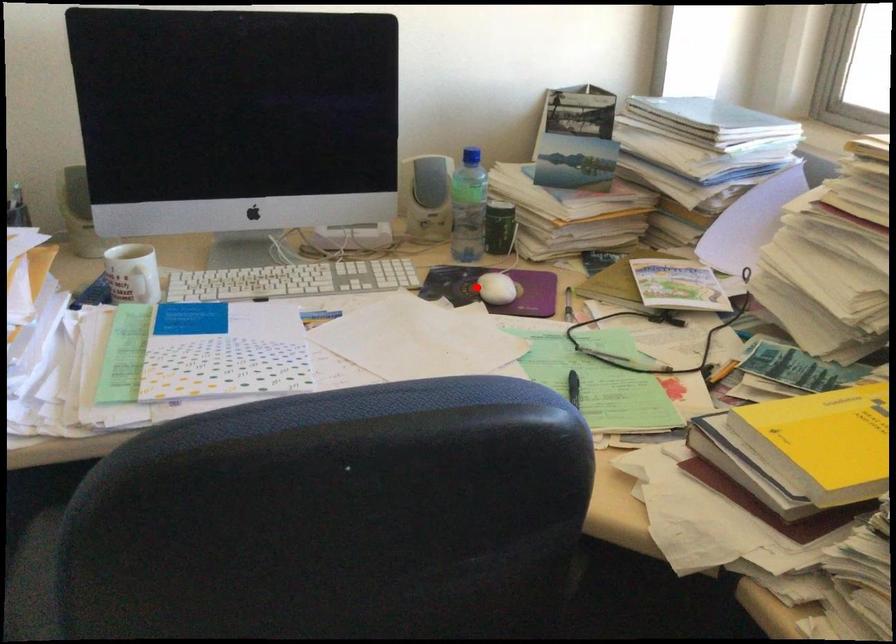
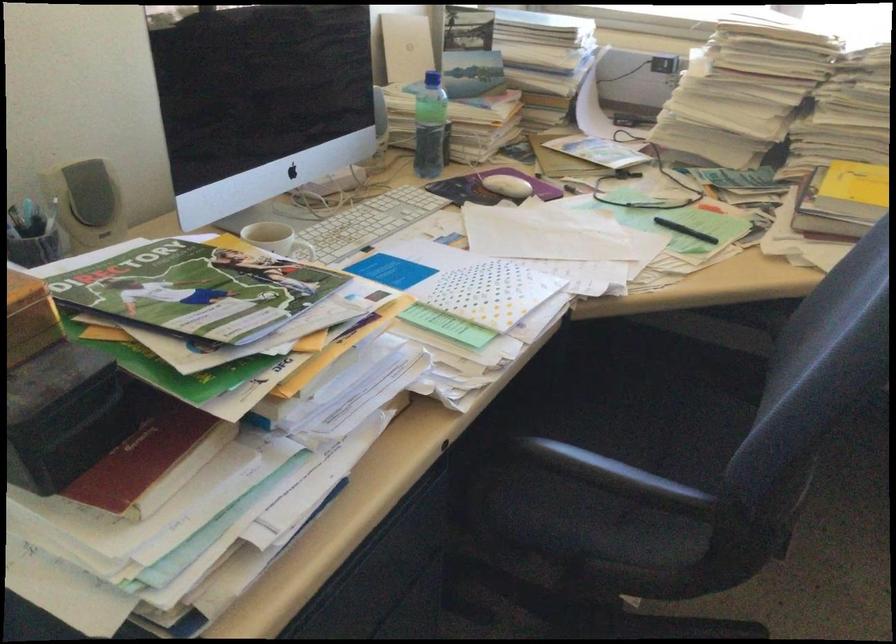
Question: I am providing you with two images of the same scene from different viewpoints. Image1 has a red point marked. In image2, the corresponding 3D location appears at what relative position? Reply with the corresponding letter.

Choices:
 (A) Closer
 (B) Farther

Answer: (B)